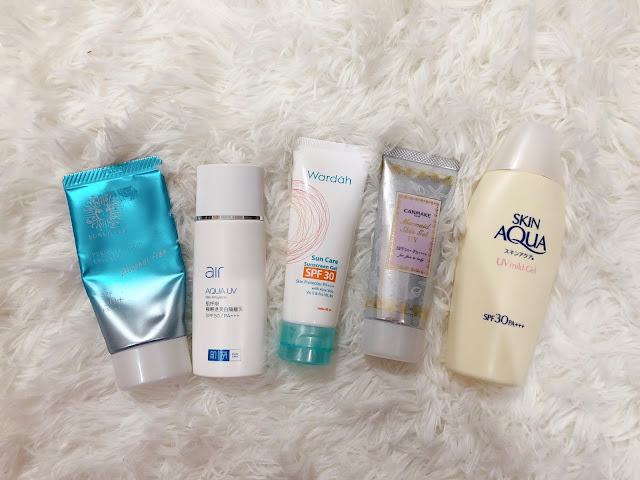
Identify the location of toiletry bottles. (150, 260), (228, 250), (317, 257), (403, 249), (509, 257).